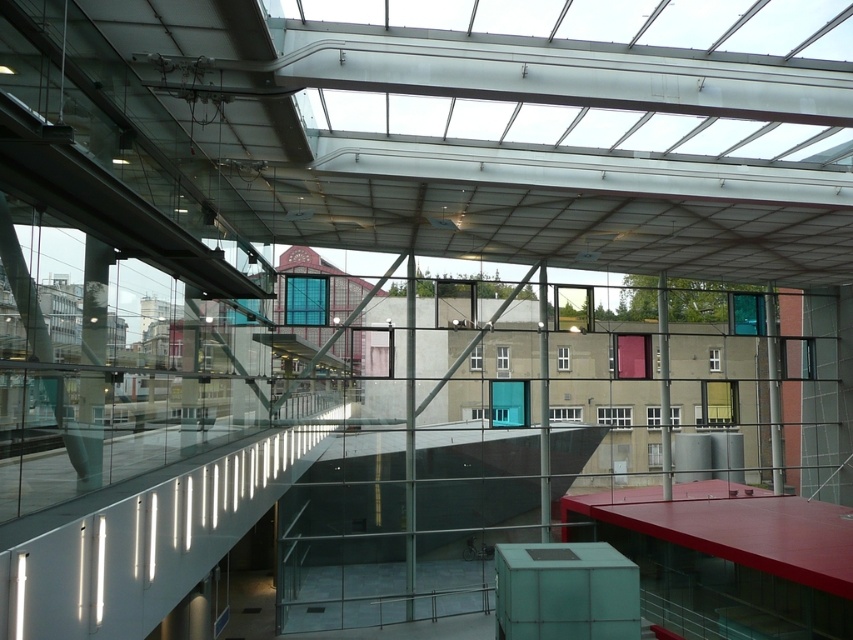
Can you confirm if matte glass pillar at left is positioned above matte glass pillar at center?

Yes, matte glass pillar at left is above matte glass pillar at center.

How much distance is there between matte glass pillar at left and matte glass pillar at center?

65.34 feet

Which is behind, point (83, 344) or point (660, 276)?

The point (660, 276) is behind.

In order to click on matte glass pillar at left in this screenshot , I will do `click(96, 300)`.